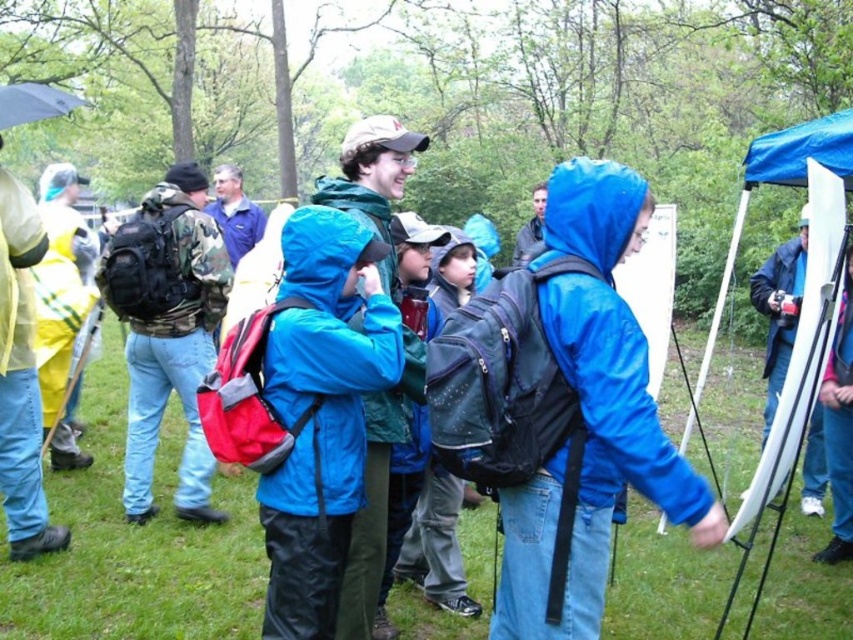
Is blue matte jacket at center further to camera compared to camo fabric backpack at left?

No, it is in front of camo fabric backpack at left.

Can you confirm if blue matte jacket at center is thinner than camo fabric backpack at left?

Indeed, blue matte jacket at center has a lesser width compared to camo fabric backpack at left.

Where is `blue matte jacket at center`? The width and height of the screenshot is (853, 640). blue matte jacket at center is located at coordinates (592, 413).

Who is taller, yellow waterproof jacket at left or matte black jacket at center?

yellow waterproof jacket at left

Does yellow waterproof jacket at left have a smaller size compared to matte black jacket at center?

No.

Locate an element on the screen. This screenshot has width=853, height=640. yellow waterproof jacket at left is located at coordinates point(61,305).

Identify the location of yellow waterproof jacket at left. This screenshot has height=640, width=853. (61, 305).

Is blue matte jacket at center below matte black jacket at center?

Yes, blue matte jacket at center is below matte black jacket at center.

Between point (577, 368) and point (527, 230), which one is positioned behind?

Positioned behind is point (527, 230).

Locate an element on the screen. blue matte jacket at center is located at coordinates (592, 413).